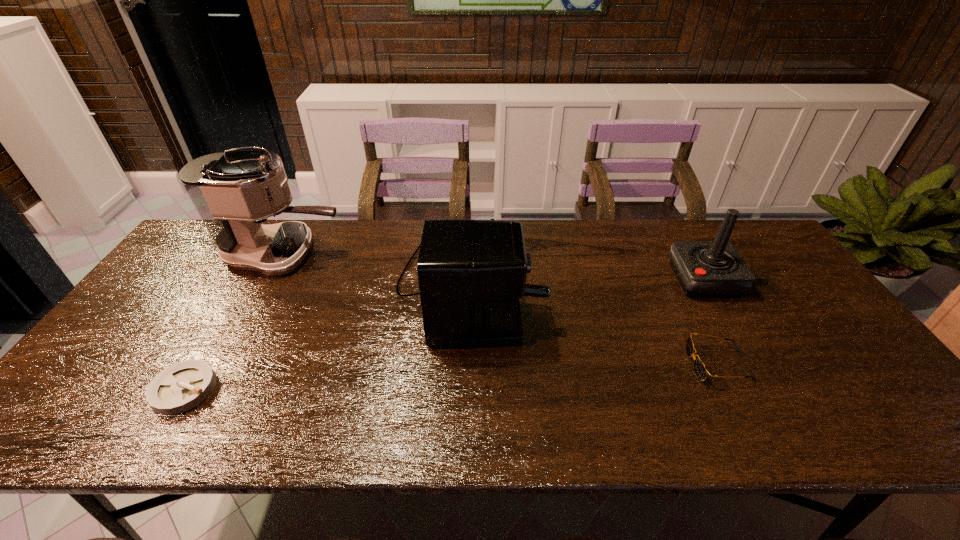
This screenshot has width=960, height=540. Find the location of `the left coffee maker`. the left coffee maker is located at coordinates (234, 192).

In order to click on the tallest object in this screenshot , I will do `click(234, 192)`.

You are a GUI agent. You are given a task and a screenshot of the screen. Output one action in this format:
    pyautogui.click(x=<x>, y=<y>)
    Task: Click on the shorter coffee maker
    
    Given the screenshot: What is the action you would take?
    [471, 273]

Locate an element on the screen. This screenshot has width=960, height=540. the right coffee maker is located at coordinates (471, 273).

You are a GUI agent. You are given a task and a screenshot of the screen. Output one action in this format:
    pyautogui.click(x=<x>, y=<y>)
    Task: Click on the joystick
    The height and width of the screenshot is (540, 960).
    Given the screenshot: What is the action you would take?
    pyautogui.click(x=705, y=269)

Where is `the fourth tallest object`? The width and height of the screenshot is (960, 540). the fourth tallest object is located at coordinates point(699,368).

Identify the location of ashtray. This screenshot has height=540, width=960. (184, 385).

You are a GUI agent. You are given a task and a screenshot of the screen. Output one action in this format:
    pyautogui.click(x=<x>, y=<y>)
    Task: Click on the vacant region located 0.350m on the front-facing side of the tallest object
    The image size is (960, 540).
    Given the screenshot: What is the action you would take?
    pyautogui.click(x=456, y=254)

Image resolution: width=960 pixels, height=540 pixels. What are the coordinates of `vacant area situated 0.050m on the front-facing side of the shorter coffee maker` in the screenshot? It's located at (557, 286).

I want to click on vacant space situated on the front-facing side of the joystick, so click(607, 280).